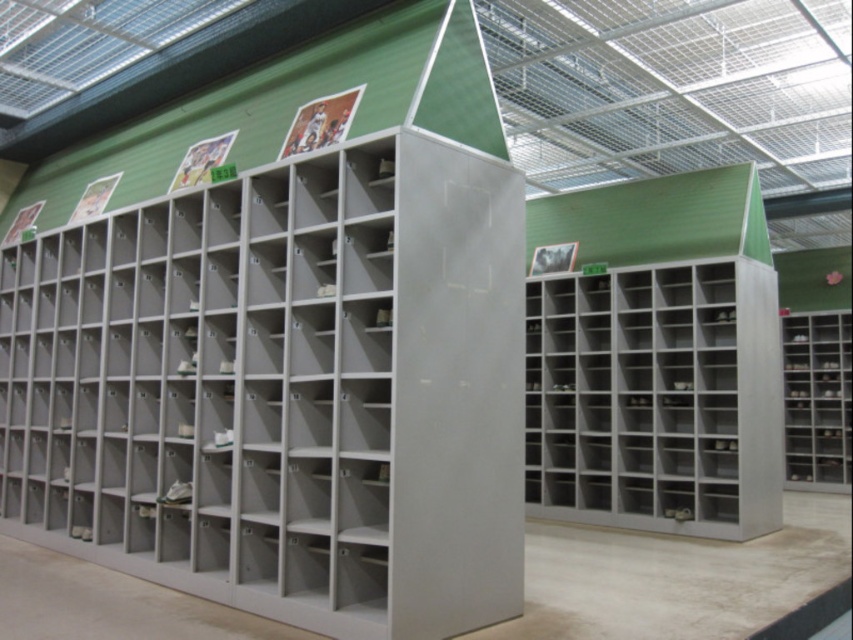
You are a warehouse worker who needs to place a tall box that requires a shelf at least 1.5 meters high. You see the matte gray bookshelf at center and the metallic gray bookshelf at right. Which one can accommodate the tall box?

The matte gray bookshelf at center is much taller than the metallic gray bookshelf at right, so it can accommodate the tall box requiring at least 1.5 meters height.

You are standing at the entrance of the storage area and want to locate the matte gray bookshelf at center. According to the coordinates given, where should you look to find it?

The matte gray bookshelf at center is located at coordinates point (283,388).

You are a delivery person trying to place a large box that is 12 feet long in the storage area. You see the matte gray bookshelf at center and the metallic gray bookshelf at center. Can you fit the box horizontally between them?

The distance between the matte gray bookshelf at center and the metallic gray bookshelf at center is 11.88 feet. Since the box is 12 feet long, it cannot fit horizontally between them as the space is slightly shorter than the box.